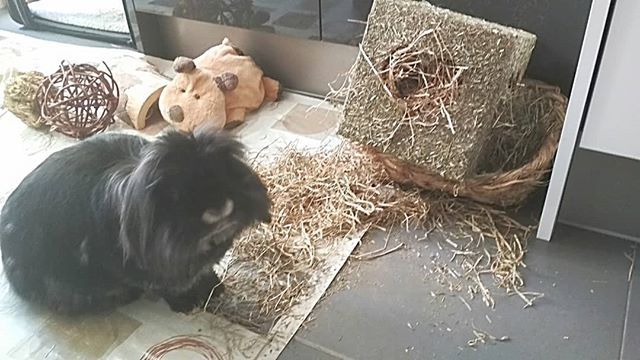
Locate an element on the screen. wicker ball is located at coordinates (109, 100), (75, 68), (48, 93), (80, 118).